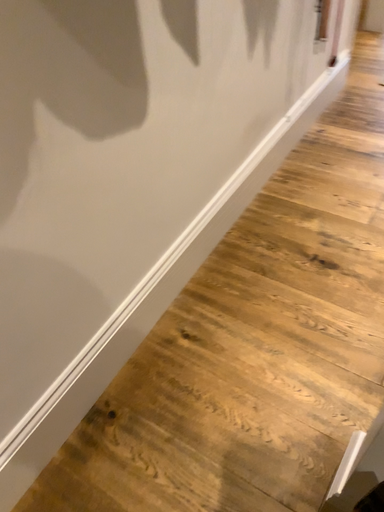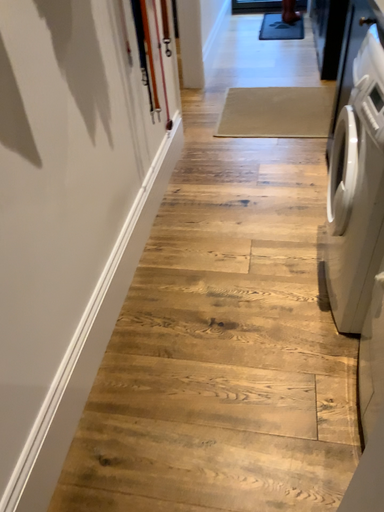
Question: How did the camera likely rotate when shooting the video?

Choices:
 (A) rotated right
 (B) rotated left

Answer: (A)